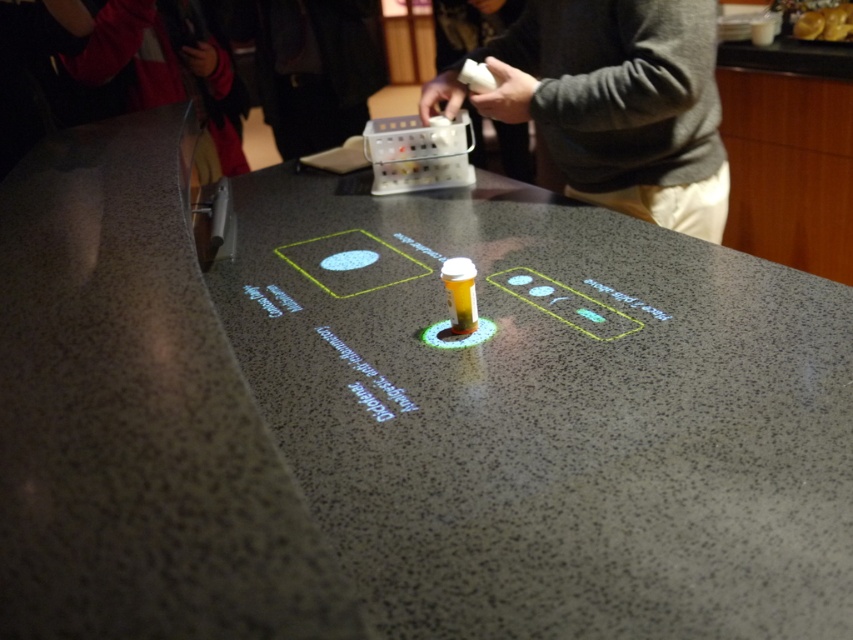
Question: Can you confirm if speckled granite counter at center is wider than gray sweater at upper center?

Choices:
 (A) yes
 (B) no

Answer: (A)

Question: Which object is closer to the camera taking this photo?

Choices:
 (A) gray sweater at upper center
 (B) speckled granite counter at center

Answer: (B)

Question: Can you confirm if speckled granite counter at center is wider than red jacket at upper left?

Choices:
 (A) yes
 (B) no

Answer: (A)

Question: Which object appears farthest from the camera in this image?

Choices:
 (A) gray sweater at upper center
 (B) red jacket at upper left
 (C) speckled granite counter at center

Answer: (B)

Question: Which of these objects is positioned farthest from the gray sweater at upper center?

Choices:
 (A) speckled granite counter at center
 (B) red jacket at upper left

Answer: (B)

Question: Can you confirm if speckled granite counter at center is smaller than red jacket at upper left?

Choices:
 (A) no
 (B) yes

Answer: (A)